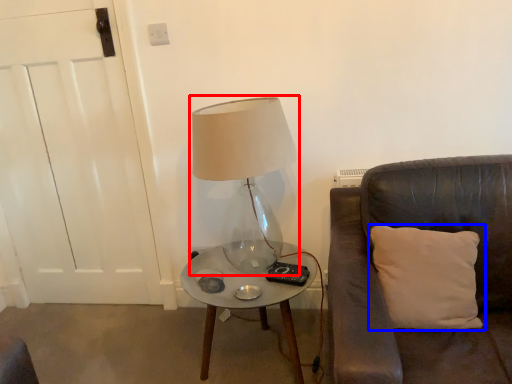
Question: Which of the following is the closest to the observer, lamp (highlighted by a red box) or pillow (highlighted by a blue box)?

Choices:
 (A) lamp
 (B) pillow

Answer: (B)